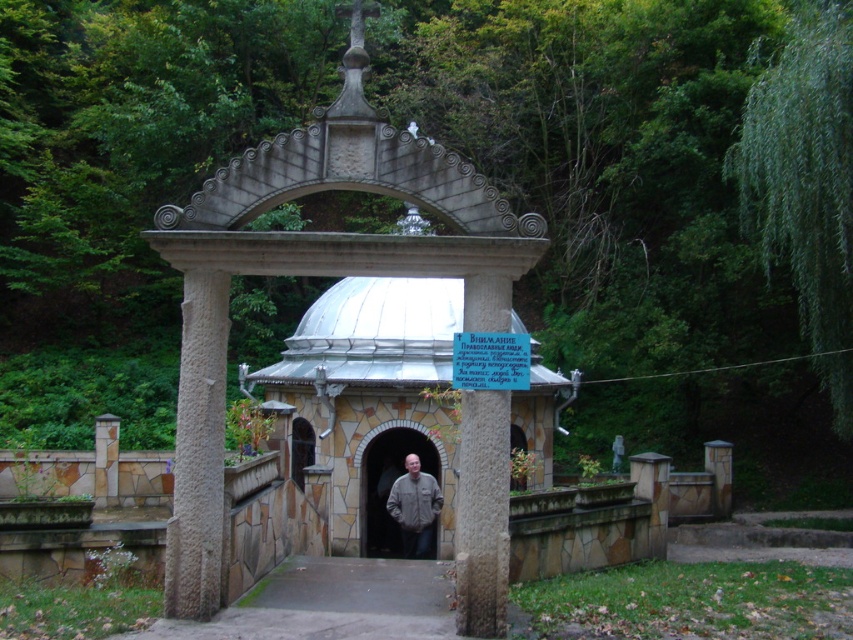
Which is behind, point (369, 531) or point (434, 502)?

The point (369, 531) is more distant.

Which is below, stone archway at center or gray fabric jacket at center?

stone archway at center is below.

Is point (428, 458) less distant than point (426, 492)?

That is False.

The height and width of the screenshot is (640, 853). What are the coordinates of `stone archway at center` in the screenshot? It's located at (390, 484).

Is the position of gray stone pillar at center more distant than that of gray fabric jacket at center?

No.

Measure the distance between point (479, 605) and camera.

Point (479, 605) and camera are 7.49 meters apart from each other.

This screenshot has height=640, width=853. In order to click on gray stone pillar at center in this screenshot , I will do `click(482, 515)`.

The height and width of the screenshot is (640, 853). Find the location of `gray stone pillar at center`. gray stone pillar at center is located at coordinates (482, 515).

Between point (476, 588) and point (390, 548), which one is positioned in front?

Positioned in front is point (476, 588).

Who is shorter, gray stone pillar at center or stone archway at center?

With less height is gray stone pillar at center.

Is point (463, 634) farther from viewer compared to point (440, 497)?

No, (463, 634) is closer to viewer.

At what (x,y) coordinates should I click in order to perform the action: click on gray stone pillar at center. Please return your answer as a coordinate pair (x, y). Looking at the image, I should click on (482, 515).